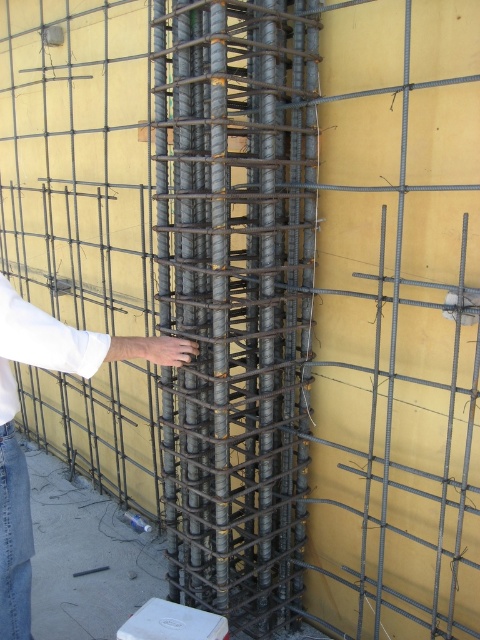
You are a safety inspector at the construction site. You notice the gray metallic rebar at center and the white cotton shirt at center. According to safety protocols, workers must keep a minimum distance of 1 meter from any exposed rebar. Is the worker complying with this rule?

The gray metallic rebar at center is located above the white cotton shirt at center, but the exact distance between them isn not specified. Therefore, it is unclear if the worker is complying with the 1 meter safety distance requirement.

You are a safety inspector at the construction site. You need to ensure that the gray metallic rebar at center is visible for inspection. Since the white cotton shirt at center is blocking part of it, how can you determine if the rebar is fully accessible for inspection?

The gray metallic rebar at center is further to the viewer than the white cotton shirt at center, so you can move the white cotton shirt at center out of the way to fully access the rebar for inspection.

Based on the coordinates provided in the scene description, where is the gray metallic rebar at center located?

The gray metallic rebar at center is located at the coordinates point (x=236, y=298).